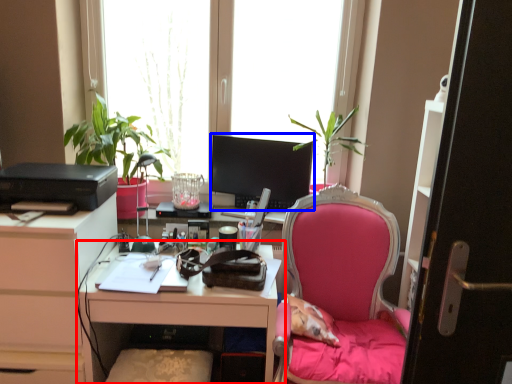
Question: Which of the following is the farthest to the observer, desk (highlighted by a red box) or television (highlighted by a blue box)?

Choices:
 (A) desk
 (B) television

Answer: (B)